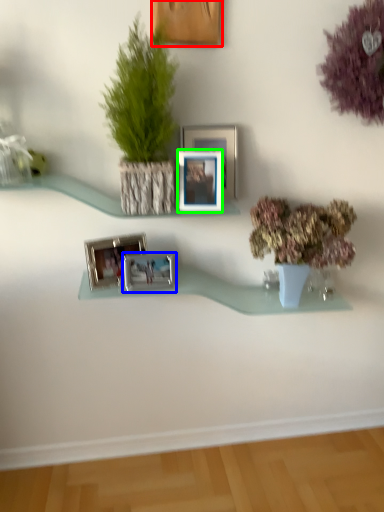
Question: Which object is the closest to the picture frame (highlighted by a red box)? Choose among these: picture frame (highlighted by a blue box) or picture frame (highlighted by a green box).

Choices:
 (A) picture frame
 (B) picture frame

Answer: (B)